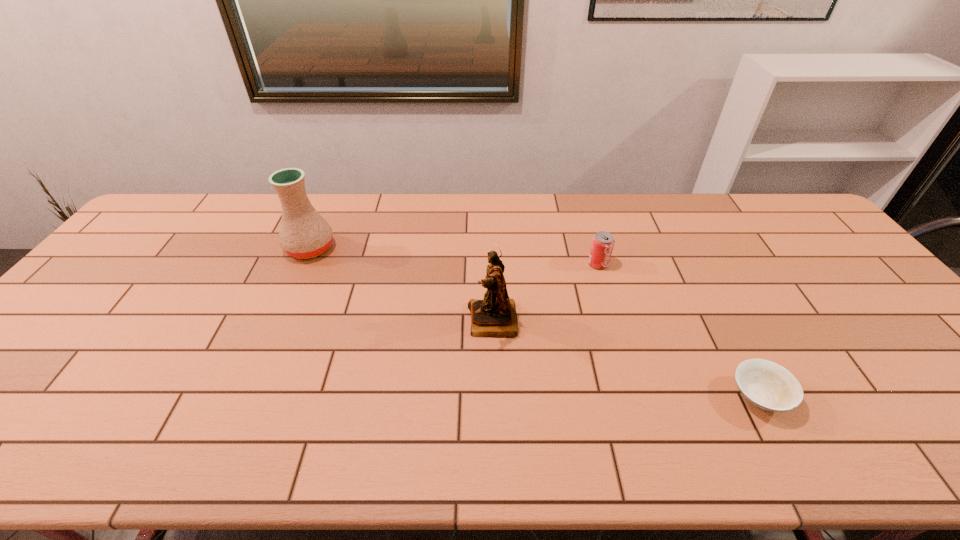
You are a GUI agent. You are given a task and a screenshot of the screen. Output one action in this format:
    pyautogui.click(x=<x>, y=<y>)
    Task: Click on the vacant space located 0.320m on the front-facing side of the third object from right to left
    
    Given the screenshot: What is the action you would take?
    pyautogui.click(x=346, y=321)

The height and width of the screenshot is (540, 960). I want to click on vacant area located on the right of the soda can, so click(x=679, y=264).

At what (x,y) coordinates should I click in order to perform the action: click on vacant space located 0.050m on the back of the bowl. Please return your answer as a coordinate pair (x, y). This screenshot has width=960, height=540. Looking at the image, I should click on (737, 355).

Locate an element on the screen. object located in the far edge section of the desktop is located at coordinates (304, 233).

This screenshot has width=960, height=540. Find the location of `object situated at the near edge`. object situated at the near edge is located at coordinates (767, 385).

At what (x,y) coordinates should I click in order to perform the action: click on vacant region at the far edge. Please return your answer as a coordinate pair (x, y). Looking at the image, I should click on (324, 193).

Locate an element on the screen. The height and width of the screenshot is (540, 960). free space at the near edge of the desktop is located at coordinates (884, 434).

Image resolution: width=960 pixels, height=540 pixels. In order to click on free point at the left edge in this screenshot , I will do `click(142, 244)`.

In the image, there is a desktop. Identify the location of vacant region at the right edge. Image resolution: width=960 pixels, height=540 pixels. (830, 256).

Locate an element on the screen. free space at the far left corner is located at coordinates (175, 231).